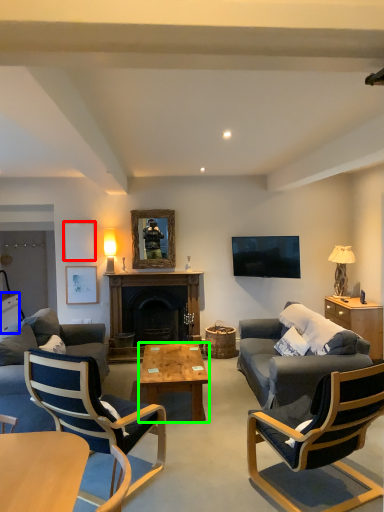
Question: Considering the real-world distances, which object is farthest from picture frame (highlighted by a red box)? cabinetry (highlighted by a blue box) or coffee table (highlighted by a green box)?

Choices:
 (A) cabinetry
 (B) coffee table

Answer: (B)